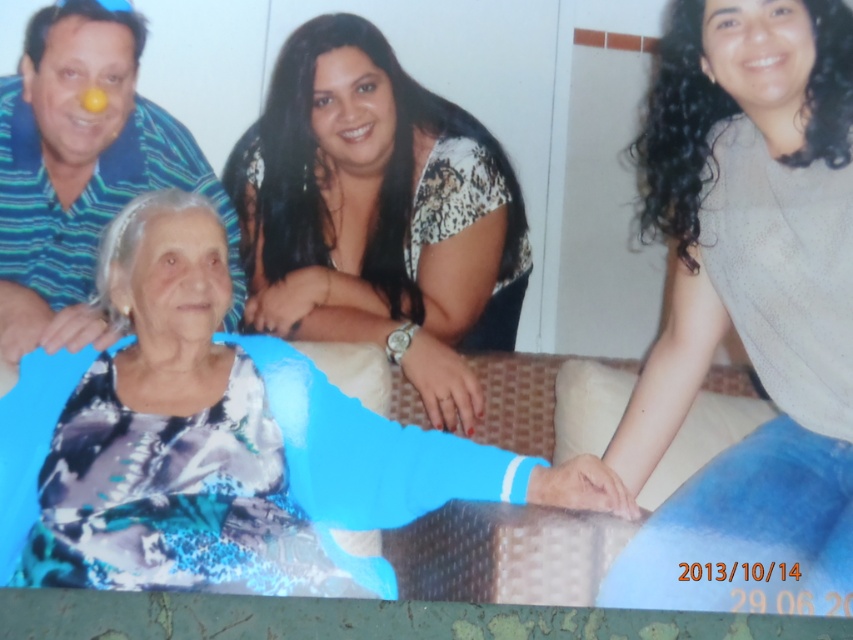
You are standing in the room where the group is seated. You want to place a small table exactly at point (679, 218). If the table requires 1.5 meters of space to be safely placed without blocking pathways, do you think there is enough space there?

The distance between point (679, 218) and the viewer is 1.44 meters, which is less than the required 1.5 meters. Therefore, placing the table there may not leave enough space and could block pathways.

You are a photographer setting up for a group photo. You notice the blue textured sweater at center and the blue striped shirt at upper left. Which clothing item should you adjust to ensure both are visible in the frame?

The blue textured sweater at center is much taller than the blue striped shirt at upper left, so you should lower the camera angle or adjust the blue textured sweater at center to avoid blocking the view of the blue striped shirt at upper left.